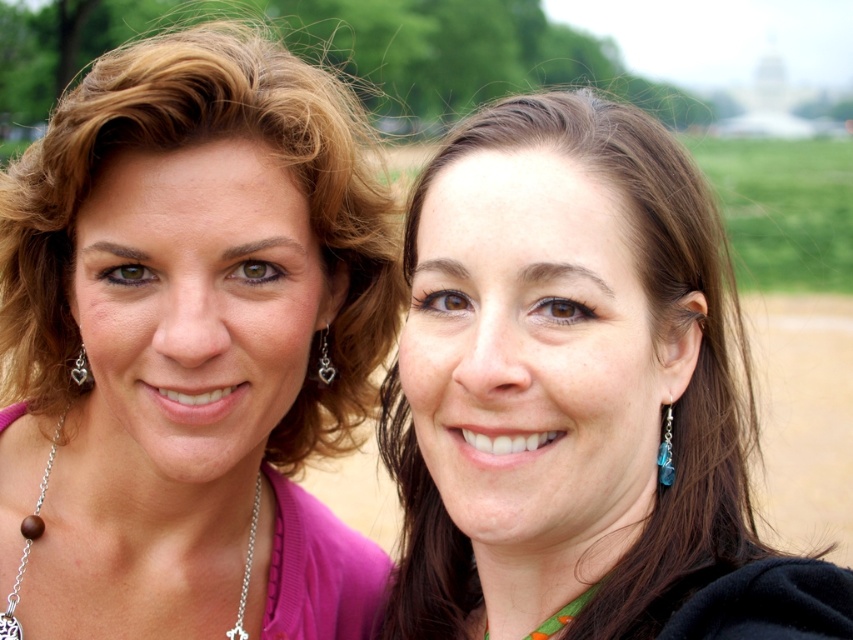
Question: Is smooth brown hair at center to the right of silver metallic chain at left from the viewer's perspective?

Choices:
 (A) no
 (B) yes

Answer: (B)

Question: Is matte pink blouse at center thinner than silver metallic chain at left?

Choices:
 (A) no
 (B) yes

Answer: (A)

Question: Which object is positioned closest to the blue glass earring at right?

Choices:
 (A) brown sandy dirt at lower right
 (B) matte pink blouse at center
 (C) smooth brown hair at center
 (D) silver metallic chain at left

Answer: (C)

Question: Which of the following is the closest to the observer?

Choices:
 (A) (120, 337)
 (B) (440, 556)

Answer: (A)

Question: Estimate the real-world distances between objects in this image. Which object is closer to the brown sandy dirt at lower right?

Choices:
 (A) smooth brown hair at center
 (B) heart-shaped silver earring at left
 (C) matte pink blouse at center
 (D) silver/heart-shaped earring at left

Answer: (A)

Question: Is blue glass earring at right closer to the viewer compared to heart-shaped silver earring at left?

Choices:
 (A) no
 (B) yes

Answer: (B)